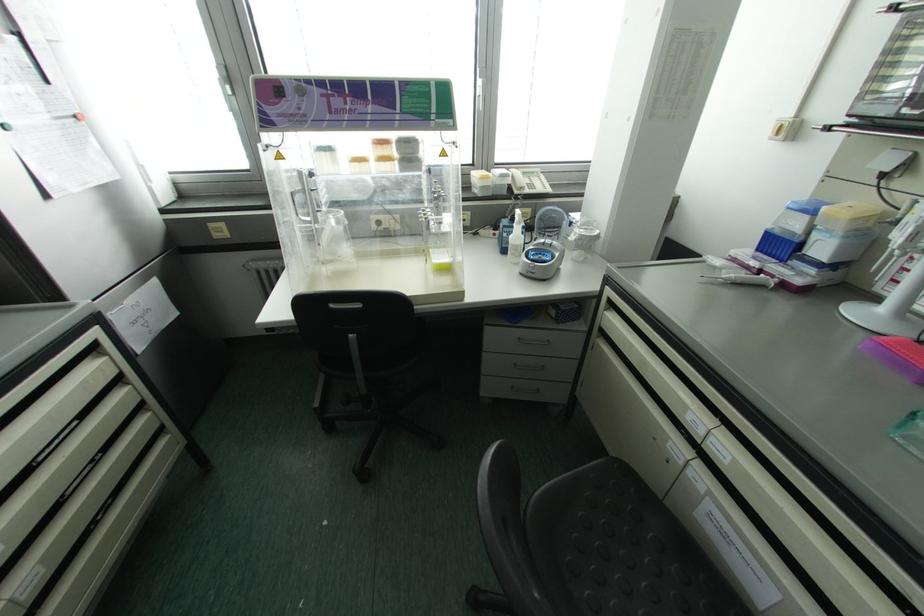
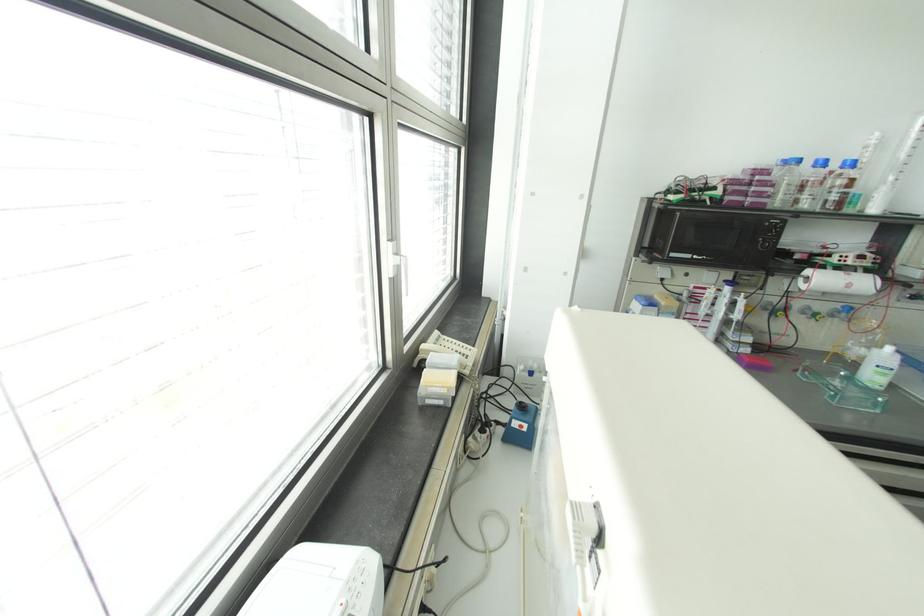
Question: I am providing you with two images of the same scene from different viewpoints. Which of the following objects are not visible in image2?

Choices:
 (A) bottle with blue cap
 (B) hanging towel
 (C) white window handle
 (D) silver drawer handle

Answer: (D)